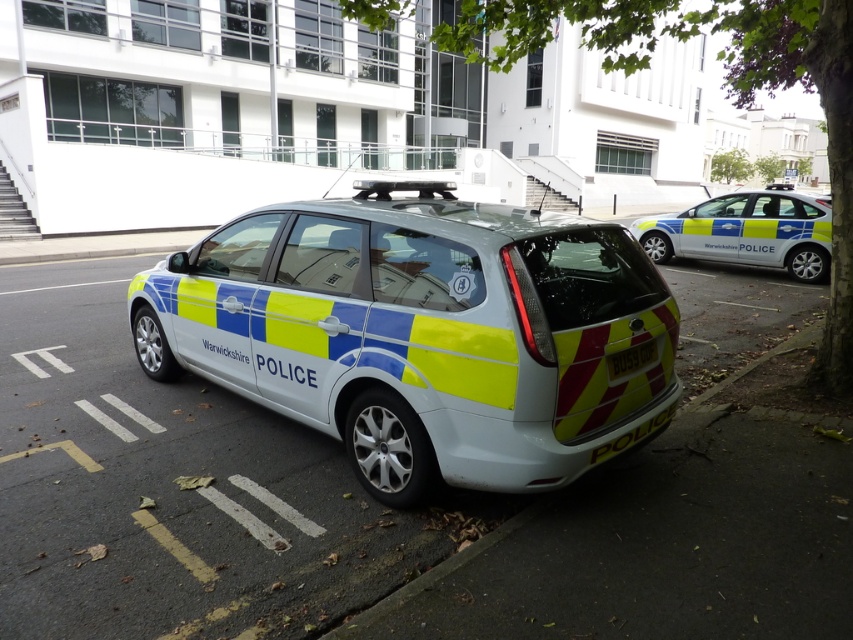
Is metallic silver police car at center to the right of white plastic license plate at rear center from the viewer's perspective?

No, metallic silver police car at center is not to the right of white plastic license plate at rear center.

What do you see at coordinates (422, 333) in the screenshot?
I see `metallic silver police car at center` at bounding box center [422, 333].

Who is more distant from viewer, (x=366, y=212) or (x=619, y=358)?

Positioned behind is point (x=366, y=212).

Where is `metallic silver police car at center`? The height and width of the screenshot is (640, 853). metallic silver police car at center is located at coordinates (422, 333).

Does metallic silver police car at center have a greater height compared to polished blue and yellow police car at right?

No.

Does metallic silver police car at center have a larger size compared to polished blue and yellow police car at right?

No.

The image size is (853, 640). Find the location of `metallic silver police car at center`. metallic silver police car at center is located at coordinates (422, 333).

Where is `metallic silver police car at center`? The width and height of the screenshot is (853, 640). metallic silver police car at center is located at coordinates (422, 333).

Which is below, polished blue and yellow police car at right or white plastic license plate at rear center?

white plastic license plate at rear center is below.

Is polished blue and yellow police car at right positioned at the back of white plastic license plate at rear center?

That is True.

Is point (817, 241) behind point (637, 348)?

Yes.

Where is `polished blue and yellow police car at right`? This screenshot has height=640, width=853. polished blue and yellow police car at right is located at coordinates (746, 230).